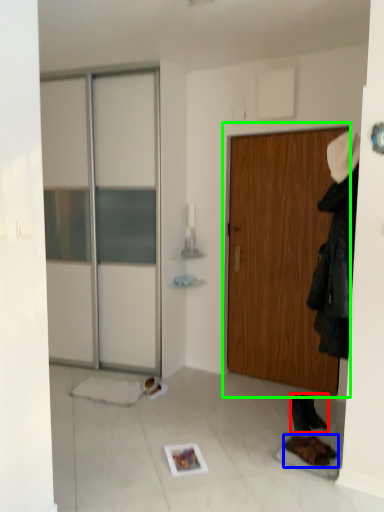
Question: Which object is positioned farthest from footwear (highlighted by a red box)? Select from footwear (highlighted by a blue box) and door (highlighted by a green box).

Choices:
 (A) footwear
 (B) door

Answer: (B)